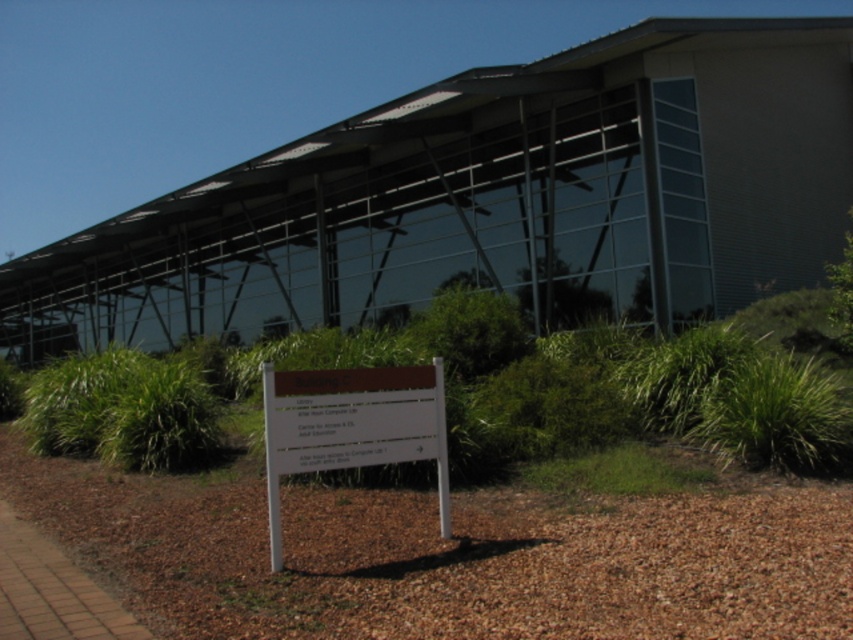
Which is below, green grass at lower right or green grass at lower center?

green grass at lower center

Can you confirm if green grass at lower right is positioned to the right of green grass at lower center?

Indeed, green grass at lower right is positioned on the right side of green grass at lower center.

The image size is (853, 640). What are the coordinates of `green grass at lower right` in the screenshot? It's located at (776, 417).

Which is behind, point (351, 465) or point (567, 465)?

Point (567, 465)

Does brown matte sign at center appear on the right side of green grass at lower center?

Incorrect, brown matte sign at center is not on the right side of green grass at lower center.

Image resolution: width=853 pixels, height=640 pixels. Find the location of `brown matte sign at center`. brown matte sign at center is located at coordinates pyautogui.click(x=351, y=426).

Locate an element on the screen. brown matte sign at center is located at coordinates (351, 426).

Consider the image. Can you confirm if brown matte sign at center is bigger than green grass at lower right?

No, brown matte sign at center is not bigger than green grass at lower right.

This screenshot has width=853, height=640. Identify the location of brown matte sign at center. (351, 426).